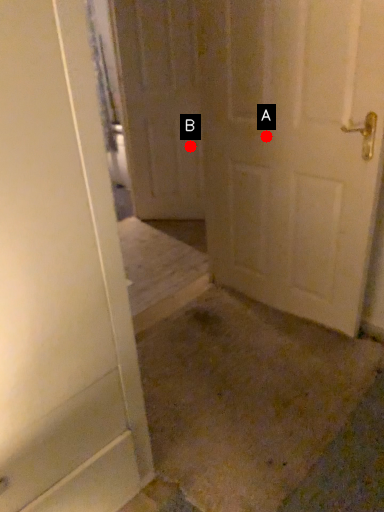
Question: Two points are circled on the image, labeled by A and B beside each circle. Which of the following is the farthest from the observer?

Choices:
 (A) A is further
 (B) B is further

Answer: (B)